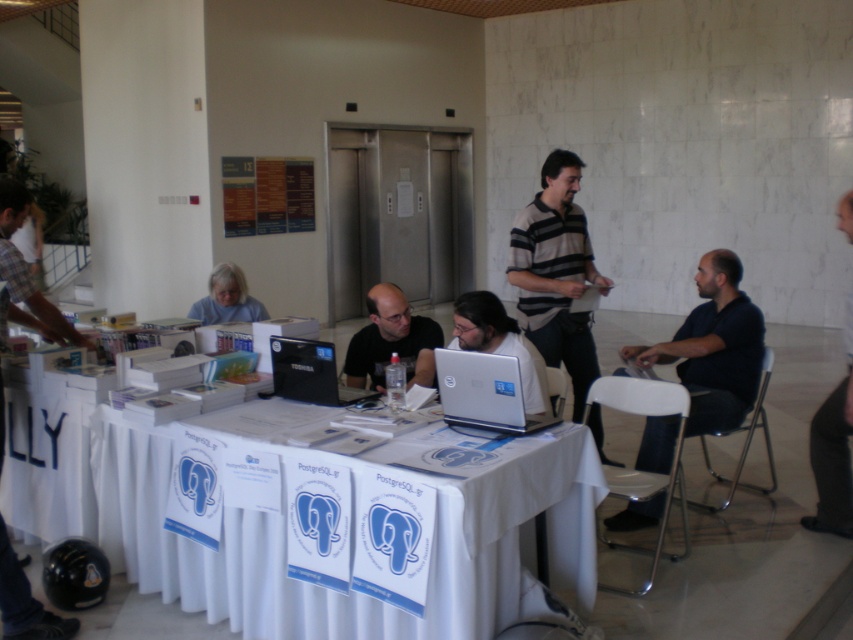
Which is below, black matte shirt at center or gray matte shirt at lower left?

Positioned lower is black matte shirt at center.

The height and width of the screenshot is (640, 853). I want to click on black matte shirt at center, so click(392, 340).

Based on the photo, can you confirm if white cloth at center is positioned to the right of silver metallic laptop at center?

Incorrect, white cloth at center is not on the right side of silver metallic laptop at center.

Can you confirm if white cloth at center is shorter than silver metallic laptop at center?

No, white cloth at center is not shorter than silver metallic laptop at center.

Is point (177, 561) positioned before point (474, 358)?

No, (177, 561) is further to viewer.

At what (x,y) coordinates should I click in order to perform the action: click on white cloth at center. Please return your answer as a coordinate pair (x, y). The image size is (853, 640). Looking at the image, I should click on (350, 529).

In the scene shown: Does silver metallic laptop at center have a lesser height compared to black fabric shirt at right?

Yes.

Identify the location of silver metallic laptop at center. The width and height of the screenshot is (853, 640). (485, 392).